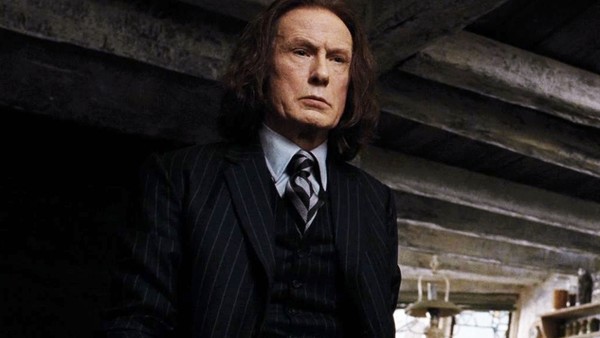
Find the location of a particular element. This screenshot has height=338, width=600. wall is located at coordinates (39, 261).